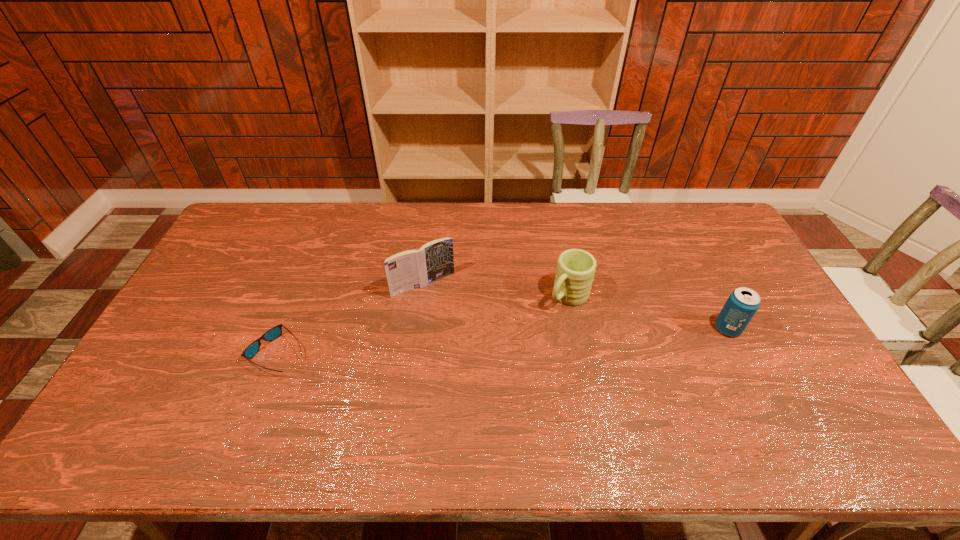
At what (x,y) coordinates should I click in order to perform the action: click on vacant space on the desktop that is between the leftmost object and the rightmost object and is positioned on the front cover of the third object from right to left. Please return your answer as a coordinate pair (x, y). The height and width of the screenshot is (540, 960). Looking at the image, I should click on (463, 343).

The width and height of the screenshot is (960, 540). I want to click on free space on the desktop that is between the shortest object and the rightmost object and is positioned on the side of the mug with the handle, so click(x=523, y=340).